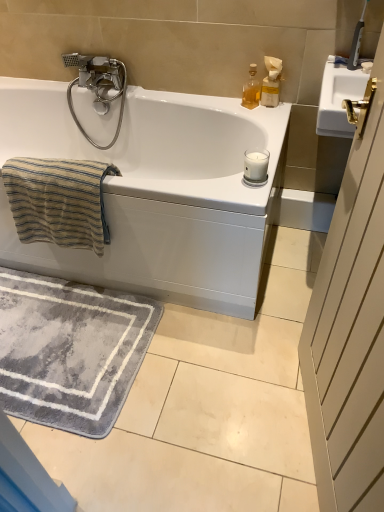
The height and width of the screenshot is (512, 384). I want to click on vacant space that is to the left of white wood screen door at right, so click(x=217, y=425).